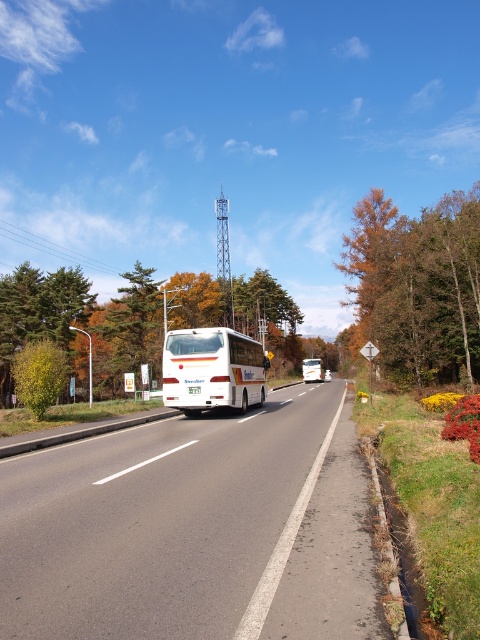
You are standing at the point labeled point (310, 362) and want to walk to the point labeled point (297, 620). Which direction should you face to walk directly towards your destination?

You should face towards the point labeled point (297, 620), which is closer to the viewer than point (310, 362). Since you are at point (310, 362), you need to walk towards the direction where the point (297, 620) is located, which is closer to you.